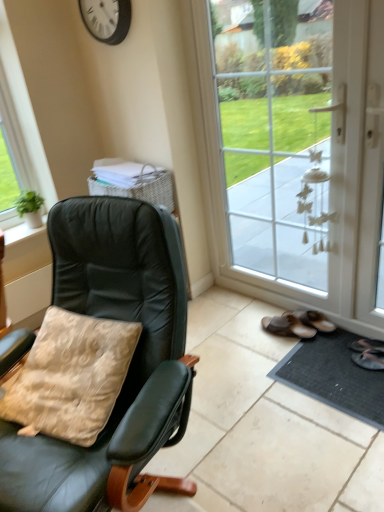
Question: From a real-world perspective, is white plastic clock at upper center positioned above or below white glass door at center?

Choices:
 (A) above
 (B) below

Answer: (A)

Question: Considering their positions, is white plastic clock at upper center located in front of or behind white glass door at center?

Choices:
 (A) behind
 (B) front

Answer: (A)

Question: Considering the real-world distances, which object is farthest from the white glass door at center?

Choices:
 (A) beige velvety pillow at left
 (B) white plastic clock at upper center
 (C) black rubber doormat at lower right
 (D) matte black chair at left

Answer: (A)

Question: Which of these objects is positioned farthest from the white glass door at center?

Choices:
 (A) beige velvety pillow at left
 (B) white plastic clock at upper center
 (C) black rubber doormat at lower right
 (D) matte black chair at left

Answer: (A)